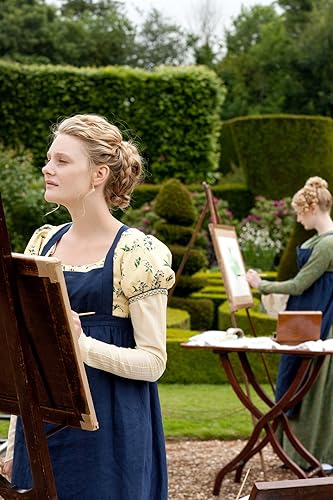
Locate an element on the screen. table is located at coordinates (261, 348).